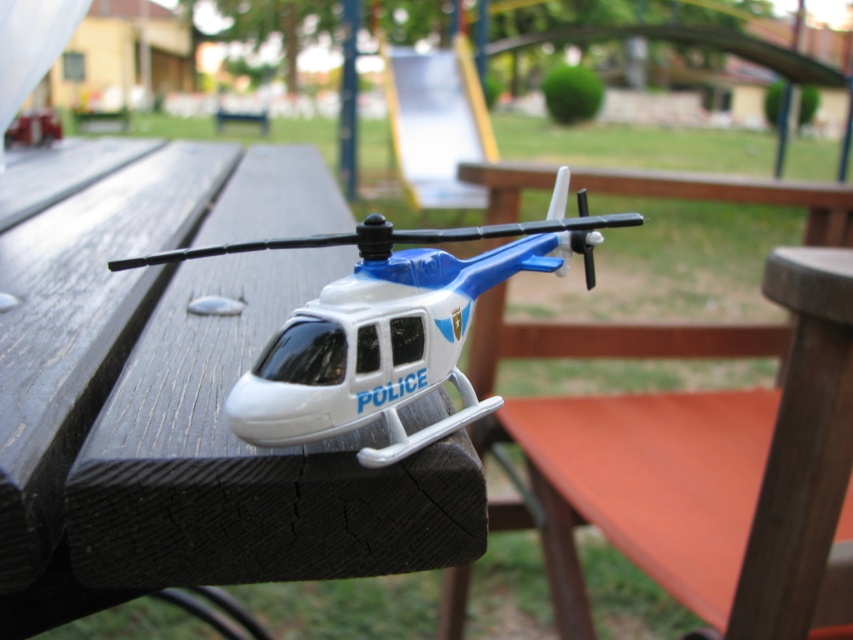
Question: Is black wood table at center to the right of white plastic helicopter at center from the viewer's perspective?

Choices:
 (A) yes
 (B) no

Answer: (B)

Question: Which point is closer to the camera taking this photo?

Choices:
 (A) (206, 436)
 (B) (334, 316)

Answer: (B)

Question: Can you confirm if black wood table at center is positioned to the left of white plastic helicopter at center?

Choices:
 (A) no
 (B) yes

Answer: (B)

Question: Is black wood table at center above white plastic helicopter at center?

Choices:
 (A) no
 (B) yes

Answer: (B)